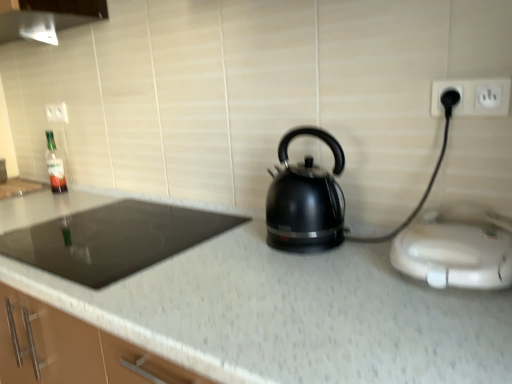
You are a GUI agent. You are given a task and a screenshot of the screen. Output one action in this format:
    pyautogui.click(x=<x>, y=<y>)
    Task: Click on the vacant region to the left of white plastic toaster at right
    
    Given the screenshot: What is the action you would take?
    pyautogui.click(x=340, y=292)